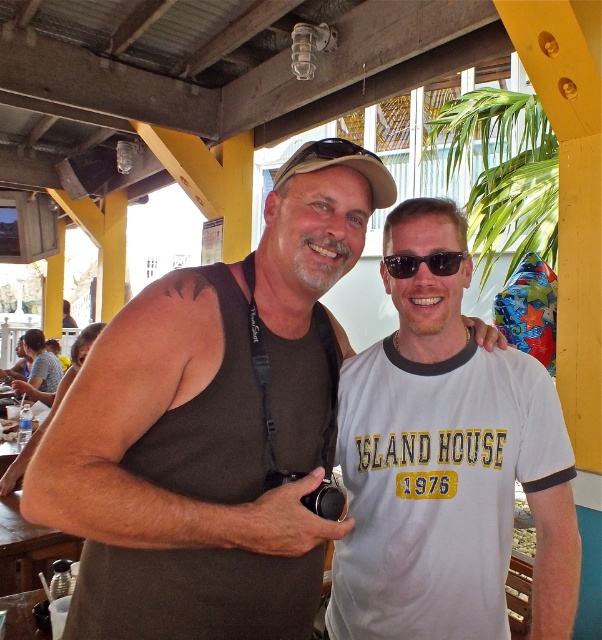
Question: Which object is closer to the camera taking this photo?

Choices:
 (A) black plastic sunglasses at center
 (B) brown matte tank top at center
 (C) brown leather tank top at upper left
 (D) brown fabric tank top at left

Answer: (B)

Question: Is white cotton t-shirt at center positioned at the back of matte brown goggles at center?

Choices:
 (A) no
 (B) yes

Answer: (B)

Question: Where is brown fabric tank top at left located in relation to black plastic sunglasses at center in the image?

Choices:
 (A) below
 (B) above

Answer: (A)

Question: Which object is closer to the camera taking this photo?

Choices:
 (A) matte brown goggles at center
 (B) white cotton t-shirt at center
 (C) black plastic sunglasses at center
 (D) brown fabric tank top at left

Answer: (D)

Question: Among these points, which one is farthest from the camera?

Choices:
 (A) (411, 256)
 (B) (394, 636)

Answer: (A)

Question: Can you confirm if brown fabric tank top at left is positioned to the left of brown leather tank top at upper left?

Choices:
 (A) no
 (B) yes

Answer: (A)